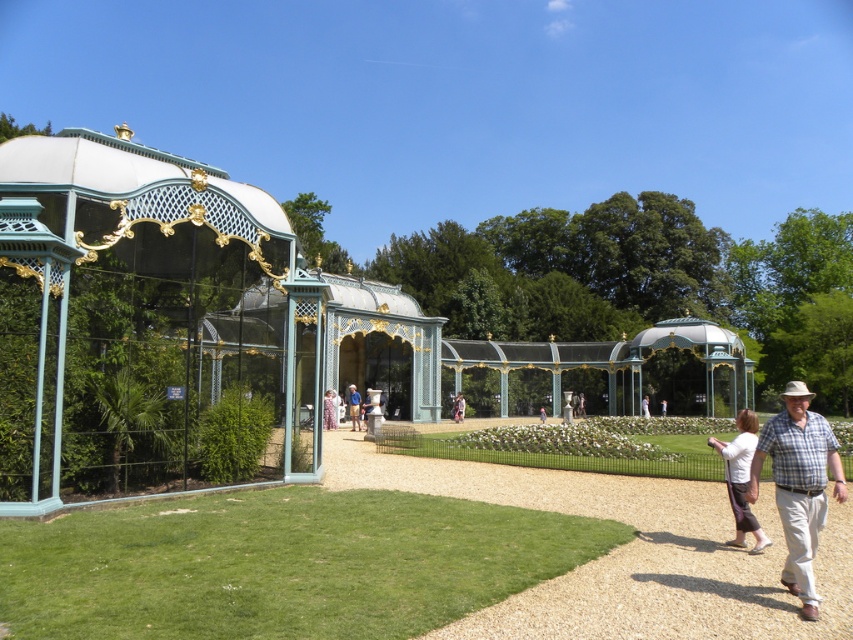
Question: Which object is closer to the camera taking this photo?

Choices:
 (A) plaid shirt at lower right
 (B) matte white statue at center
 (C) white cotton shirt at lower right

Answer: (A)

Question: Among these points, which one is nearest to the camera?

Choices:
 (A) (744, 433)
 (B) (804, 406)
 (C) (368, 401)

Answer: (B)

Question: Among these objects, which one is nearest to the camera?

Choices:
 (A) matte white statue at center
 (B) plaid shirt at lower right

Answer: (B)

Question: Does plaid shirt at lower right appear over white cotton shirt at lower right?

Choices:
 (A) no
 (B) yes

Answer: (B)

Question: Is white cotton shirt at lower right positioned behind matte white statue at center?

Choices:
 (A) yes
 (B) no

Answer: (B)

Question: Is plaid shirt at lower right positioned at the back of matte white statue at center?

Choices:
 (A) yes
 (B) no

Answer: (B)